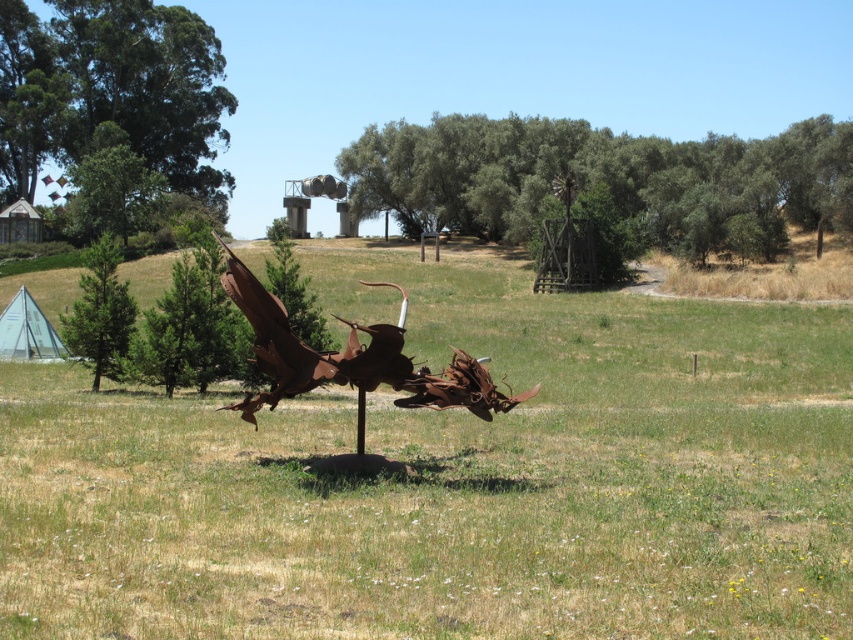
Between rusty metal sculpture at center and green leafy tree at upper left, which one has less height?

Standing shorter between the two is rusty metal sculpture at center.

The height and width of the screenshot is (640, 853). I want to click on rusty metal sculpture at center, so click(x=454, y=480).

Between rusty metal sculpture at center and green leafy tree at upper center, which one is positioned lower?

rusty metal sculpture at center is lower down.

Between point (492, 349) and point (505, 180), which one is positioned in front?

Positioned in front is point (492, 349).

This screenshot has width=853, height=640. I want to click on rusty metal sculpture at center, so click(454, 480).

Does green leafy tree at upper center appear over rusty metal dragon at center?

Correct, green leafy tree at upper center is located above rusty metal dragon at center.

Can you confirm if green leafy tree at upper center is wider than rusty metal dragon at center?

Yes.

Describe the element at coordinates (605, 179) in the screenshot. This screenshot has width=853, height=640. I see `green leafy tree at upper center` at that location.

Identify the location of green leafy tree at upper center. (605, 179).